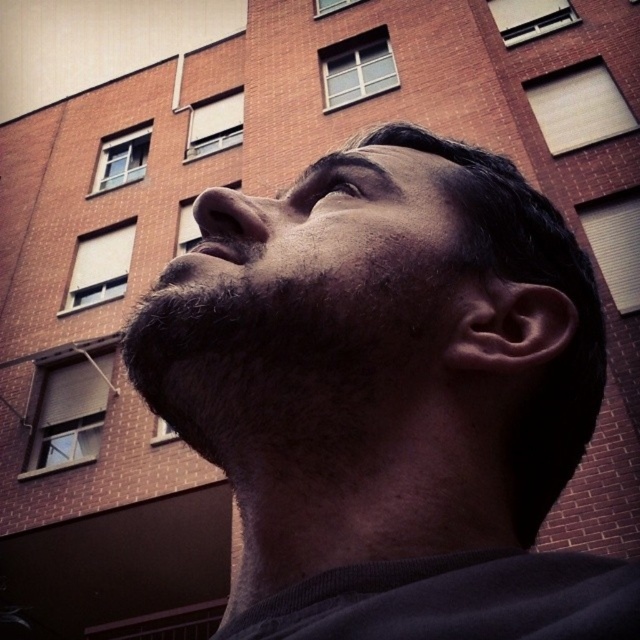
Question: Is dark hair at center smaller than dark beard at center?

Choices:
 (A) no
 (B) yes

Answer: (A)

Question: Which object is positioned farthest from the dark hair at center?

Choices:
 (A) dark beard at center
 (B) brown matte eye at upper center

Answer: (B)

Question: Considering the relative positions of dark hair at center and dark beard at center in the image provided, where is dark hair at center located with respect to dark beard at center?

Choices:
 (A) right
 (B) left

Answer: (A)

Question: Which of the following is the farthest from the observer?

Choices:
 (A) (285, 243)
 (B) (336, 196)

Answer: (B)

Question: Which of the following is the farthest from the observer?

Choices:
 (A) (212, 241)
 (B) (368, 192)
 (C) (557, 291)

Answer: (B)

Question: Is dark hair at center positioned at the back of dark beard at center?

Choices:
 (A) yes
 (B) no

Answer: (B)